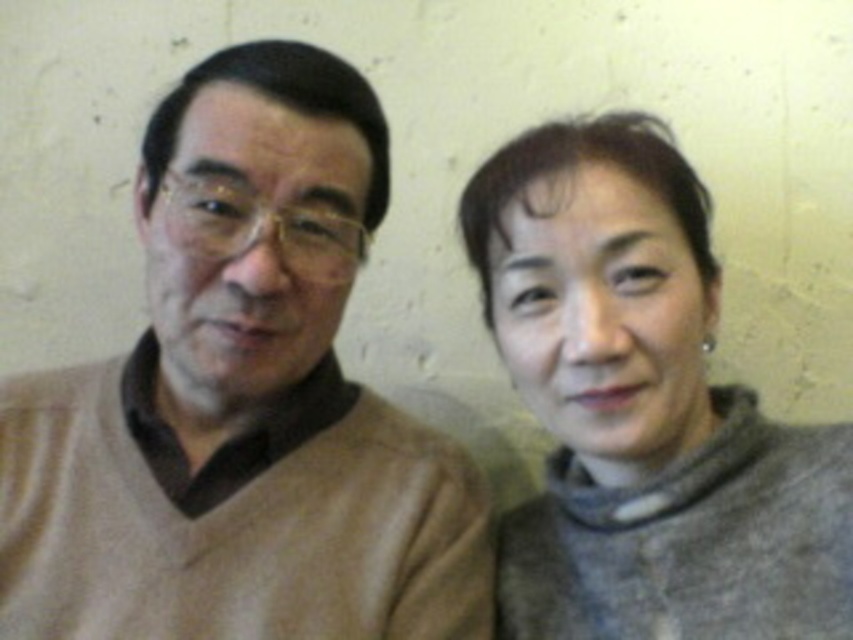
Question: Is beige sweater at left smaller than gray woolen sweater at right?

Choices:
 (A) yes
 (B) no

Answer: (A)

Question: Can you confirm if beige sweater at left is smaller than gray woolen sweater at right?

Choices:
 (A) yes
 (B) no

Answer: (A)

Question: Which point is farther to the camera?

Choices:
 (A) beige sweater at left
 (B) gray woolen sweater at right

Answer: (B)

Question: Which of the following is the farthest from the observer?

Choices:
 (A) (824, 480)
 (B) (158, 592)

Answer: (A)

Question: Which object is farther from the camera taking this photo?

Choices:
 (A) beige sweater at left
 (B) gray woolen sweater at right

Answer: (B)

Question: Can you confirm if beige sweater at left is wider than gray woolen sweater at right?

Choices:
 (A) no
 (B) yes

Answer: (B)